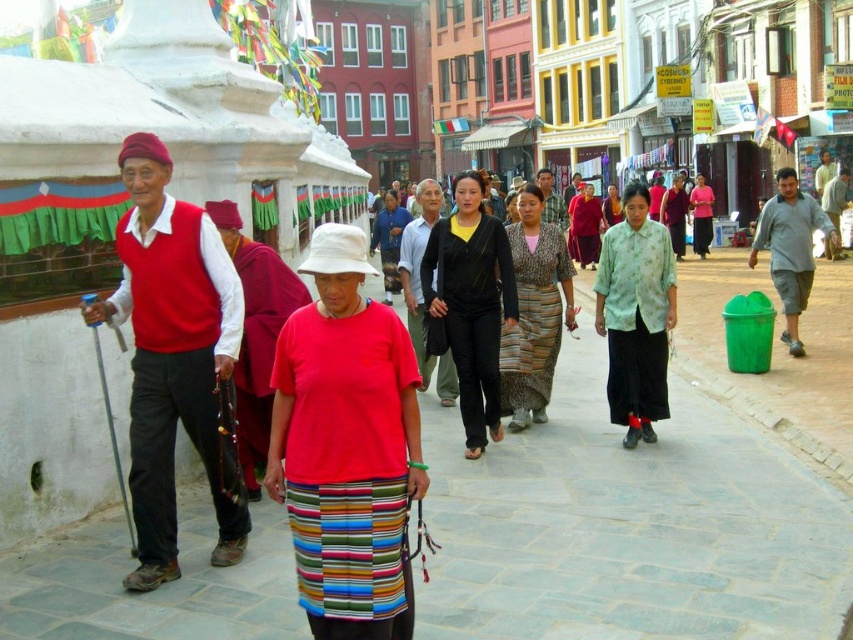
You are standing on the street and want to determine which of the two points, point (486,376) or point (509,376), is closer to you. Based on the scene description, which point is nearer?

Point (486,376) is closer to the viewer than point (509,376).